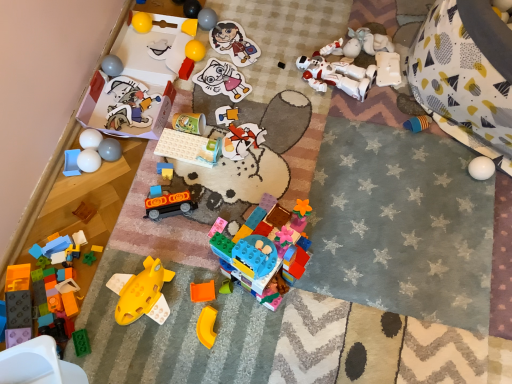
Locate an element on the screen. This screenshot has width=512, height=384. free area in between matte plastic blocks at center, the 9th toy viewed from the left, and smooth yellow ball at upper center, the ninth toy from the right is located at coordinates (185, 104).